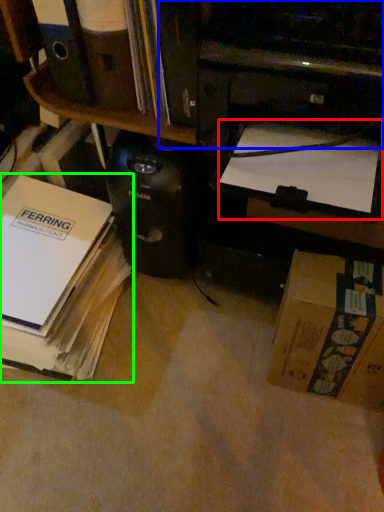
Question: Which object is the closest to the book (highlighted by a red box)? Choose among these: printer (highlighted by a blue box) or book (highlighted by a green box).

Choices:
 (A) printer
 (B) book

Answer: (A)